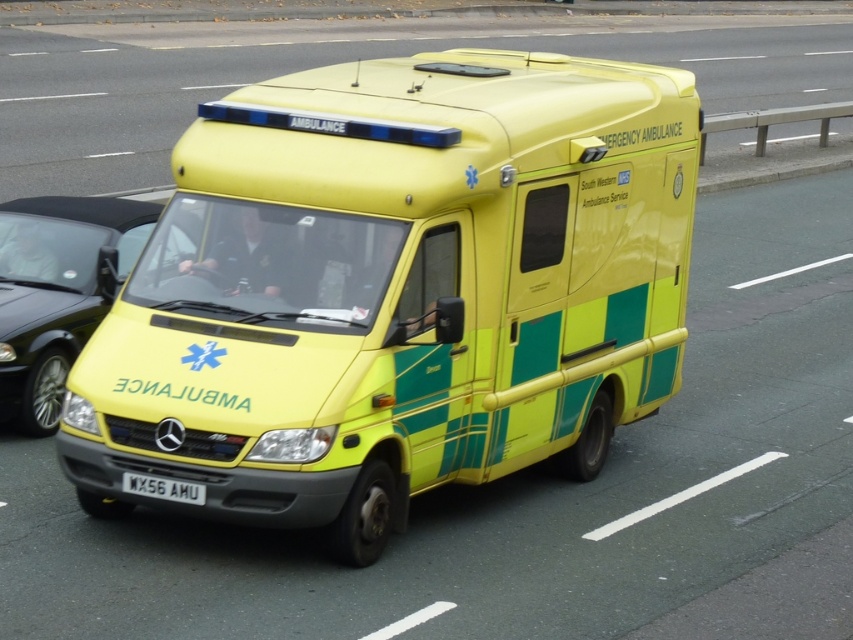
Measure the distance between point [48,388] and camera.

A: A distance of 8.43 meters exists between point [48,388] and camera.

Does point (33, 346) come in front of point (138, 474)?

That is False.

Find the location of `yellow matte ambulance at center`. yellow matte ambulance at center is located at coordinates (57, 291).

Is point (485, 257) positioned behind point (83, 218)?

No.

Is yellow/green plastic ambulance at center taller than yellow matte ambulance at center?

Incorrect, yellow/green plastic ambulance at center's height is not larger of yellow matte ambulance at center's.

At what (x,y) coordinates should I click in order to perform the action: click on yellow/green plastic ambulance at center. Please return your answer as a coordinate pair (x, y). Looking at the image, I should click on (395, 289).

Does yellow/green plastic ambulance at center come behind white plastic license plate at center?

That is True.

How much distance is there between yellow/green plastic ambulance at center and white plastic license plate at center?

A distance of 1.37 meters exists between yellow/green plastic ambulance at center and white plastic license plate at center.

Between point (328, 369) and point (151, 481), which one is positioned in front?

Point (328, 369) is more forward.

Where is `yellow/green plastic ambulance at center`? The height and width of the screenshot is (640, 853). yellow/green plastic ambulance at center is located at coordinates (395, 289).